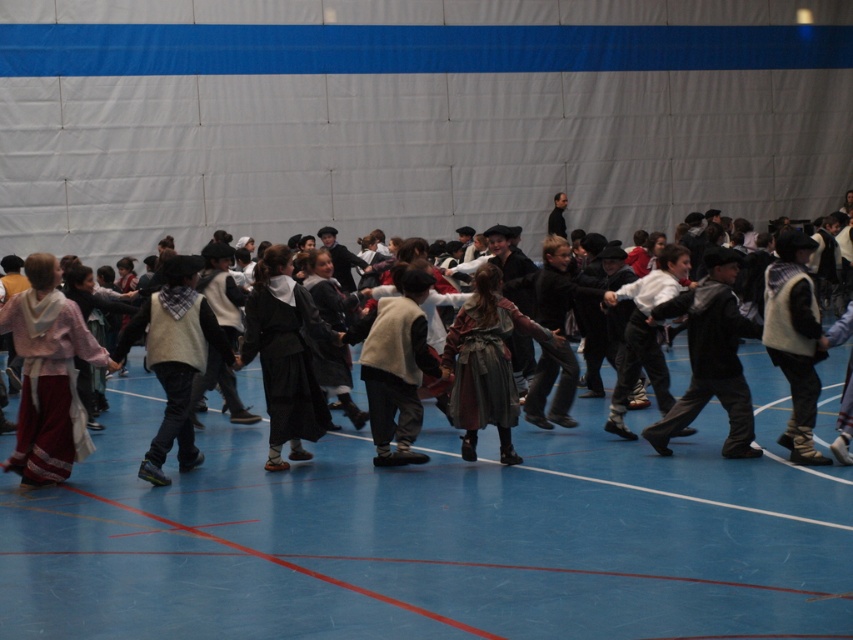
You are a dance instructor planning to place a large storage box in the gymnasium. The box is 2 meters wide. Looking at the image, can you determine if the blue rubber floor at center has enough space to accommodate the storage box compared to the velvet black vest at center?

The blue rubber floor at center occupies less space than velvet black vest at center. Since the velvet black vest at center is larger, the blue rubber floor at center may not have enough space to fit the 2 meter wide storage box.

You are a photographer setting up a tripod to capture the children in the blue rubber floor at center and the velvet black vest at center. Which object is shorter?

The blue rubber floor at center is not as tall as the velvet black vest at center, so the blue rubber floor at center is shorter.

You are standing in the gymnasium and notice two points marked on the floor. The first point is at coordinates point (511, 554) and the second is at point (705, 433). Which point is closer to you?

Point (511, 554) is closer to the viewer than point (705, 433), so the first point is closer to you.